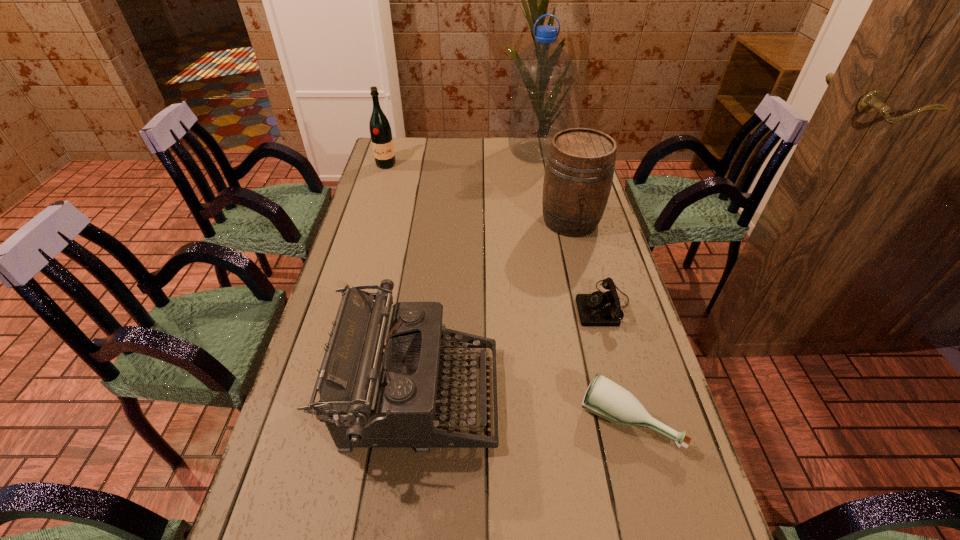
This screenshot has height=540, width=960. I want to click on vacant space that satisfies the following two spatial constraints: 1. on the side of the bottle near the bung hole; 2. on the left side of the third farthest object, so click(x=619, y=420).

At what (x,y) coordinates should I click in order to perform the action: click on vacant area that satisfies the following two spatial constraints: 1. on the typing side of the third shortest object; 2. on the right side of the bottle. Please return your answer as a coordinate pair (x, y). The width and height of the screenshot is (960, 540). Looking at the image, I should click on (416, 420).